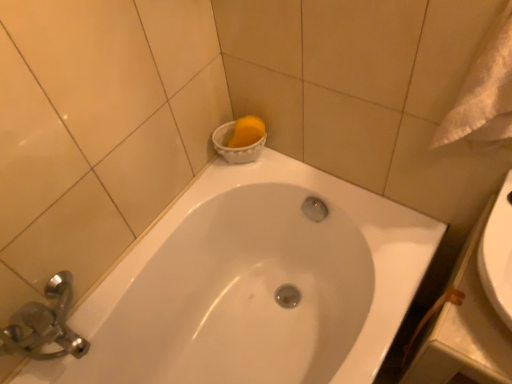
Question: Is white glossy bathtub at upper center wider than white textured towel at upper right?

Choices:
 (A) yes
 (B) no

Answer: (A)

Question: From the image's perspective, is white glossy bathtub at upper center located beneath white textured towel at upper right?

Choices:
 (A) no
 (B) yes

Answer: (B)

Question: Is white glossy bathtub at upper center further to camera compared to white textured towel at upper right?

Choices:
 (A) no
 (B) yes

Answer: (B)

Question: Does white glossy bathtub at upper center have a greater height compared to white textured towel at upper right?

Choices:
 (A) yes
 (B) no

Answer: (A)

Question: Does white glossy bathtub at upper center have a larger size compared to white textured towel at upper right?

Choices:
 (A) no
 (B) yes

Answer: (B)

Question: Is white glossy bathtub at upper center turned away from white textured towel at upper right?

Choices:
 (A) yes
 (B) no

Answer: (B)

Question: Are white textured towel at upper right and white glossy bathtub at upper center beside each other?

Choices:
 (A) no
 (B) yes

Answer: (A)

Question: Is white textured towel at upper right at the left side of white glossy bathtub at upper center?

Choices:
 (A) yes
 (B) no

Answer: (B)

Question: Can we say white textured towel at upper right lies outside white glossy bathtub at upper center?

Choices:
 (A) no
 (B) yes

Answer: (B)

Question: From the image's perspective, does white textured towel at upper right appear lower than white glossy bathtub at upper center?

Choices:
 (A) yes
 (B) no

Answer: (B)

Question: Is white textured towel at upper right shorter than white glossy bathtub at upper center?

Choices:
 (A) yes
 (B) no

Answer: (A)

Question: From the image's perspective, would you say white textured towel at upper right is positioned over white glossy bathtub at upper center?

Choices:
 (A) no
 (B) yes

Answer: (B)

Question: Looking at their shapes, would you say white glossy bathtub at upper center is wider or thinner than white textured towel at upper right?

Choices:
 (A) thin
 (B) wide

Answer: (B)